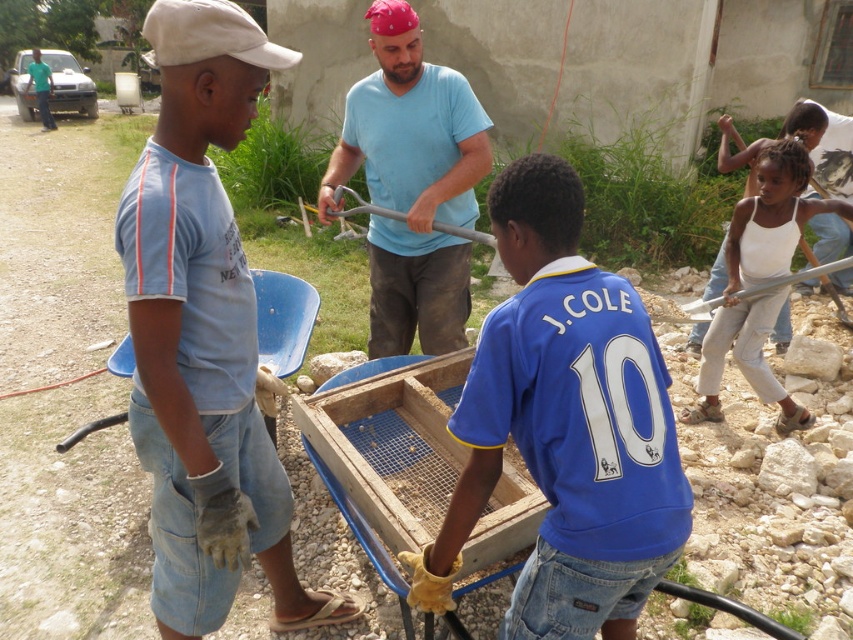
Question: Considering the relative positions of light blue t-shirt at left and white cotton tank top at right in the image provided, where is light blue t-shirt at left located with respect to white cotton tank top at right?

Choices:
 (A) left
 (B) right

Answer: (A)

Question: Does blue jersey at center appear under blue cotton shirt at center?

Choices:
 (A) yes
 (B) no

Answer: (A)

Question: Does blue cotton shirt at center have a lesser width compared to white cotton tank top at right?

Choices:
 (A) yes
 (B) no

Answer: (A)

Question: Estimate the real-world distances between objects in this image. Which object is closer to the white cotton tank top at right?

Choices:
 (A) blue cotton shirt at center
 (B) light blue t-shirt at left
 (C) blue jersey at center

Answer: (A)

Question: Which object is positioned closest to the blue jersey at center?

Choices:
 (A) white cotton tank top at right
 (B) blue cotton shirt at center
 (C) light blue t-shirt at left

Answer: (C)

Question: Which object is the farthest from the light blue t-shirt at left?

Choices:
 (A) blue jersey at center
 (B) blue cotton shirt at center

Answer: (B)